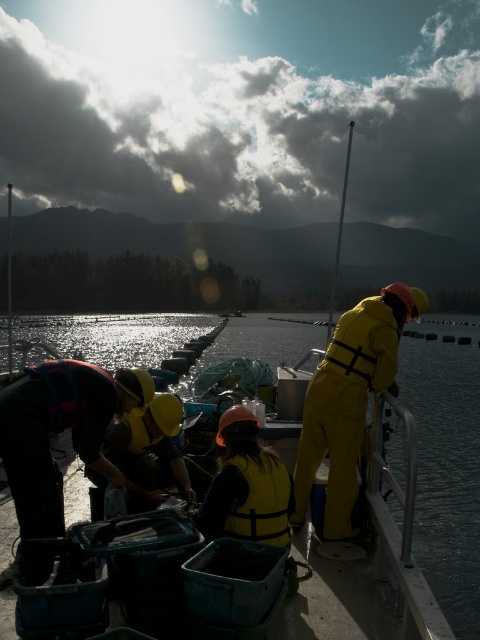
You are a safety inspector on the boat and need to locate the yellow matte safety vest at center. Where is it in relation to the clear water at center?

The clear water at center is positioned on the right side of yellow matte safety vest at center, so the yellow matte safety vest at center is located to the left of the clear water at center.

You are standing on the deck of the boat and want to reach a point marked at coordinates point (439, 348). If your current position is 30 meters away from that point, can you safely walk to it without needing to move further away?

The distance of point (439, 348) from viewer is 36.87 meters. Since you are currently 30 meters away, you need to move an additional 6.87 meters closer to reach it safely.